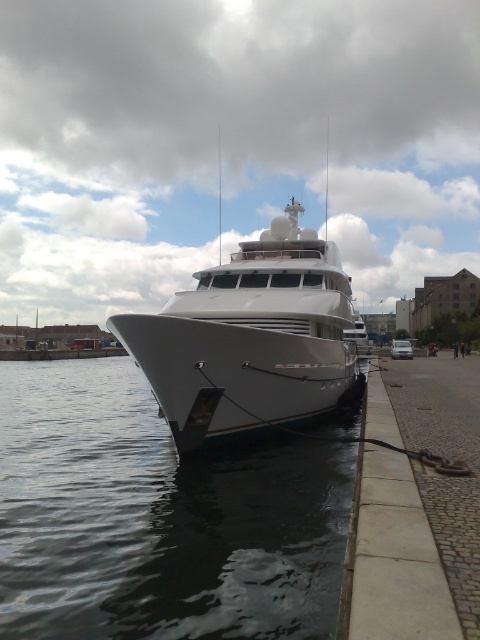
Question: Is clear water at lower left closer to camera compared to white glossy yacht at center?

Choices:
 (A) yes
 (B) no

Answer: (A)

Question: Can you confirm if clear water at lower left is wider than white glossy yacht at center?

Choices:
 (A) yes
 (B) no

Answer: (A)

Question: Can you confirm if clear water at lower left is positioned below white glossy yacht at center?

Choices:
 (A) no
 (B) yes

Answer: (B)

Question: Among these points, which one is farthest from the camera?

Choices:
 (A) (22, 556)
 (B) (184, 401)

Answer: (B)